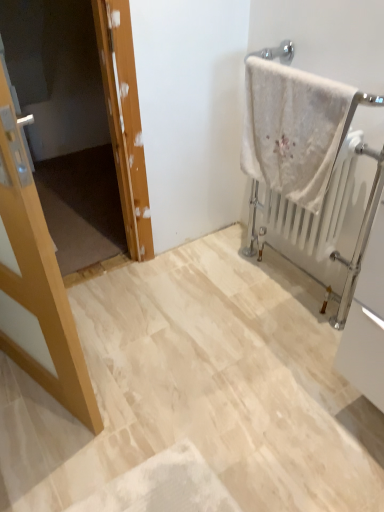
Where is `vacant space to the right of light wood door at left`? The image size is (384, 512). vacant space to the right of light wood door at left is located at coordinates (150, 376).